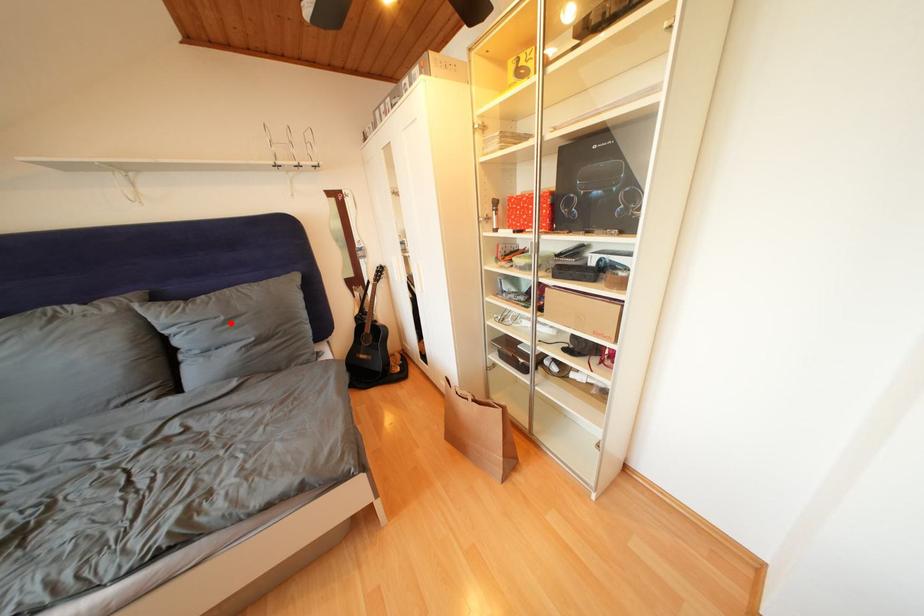
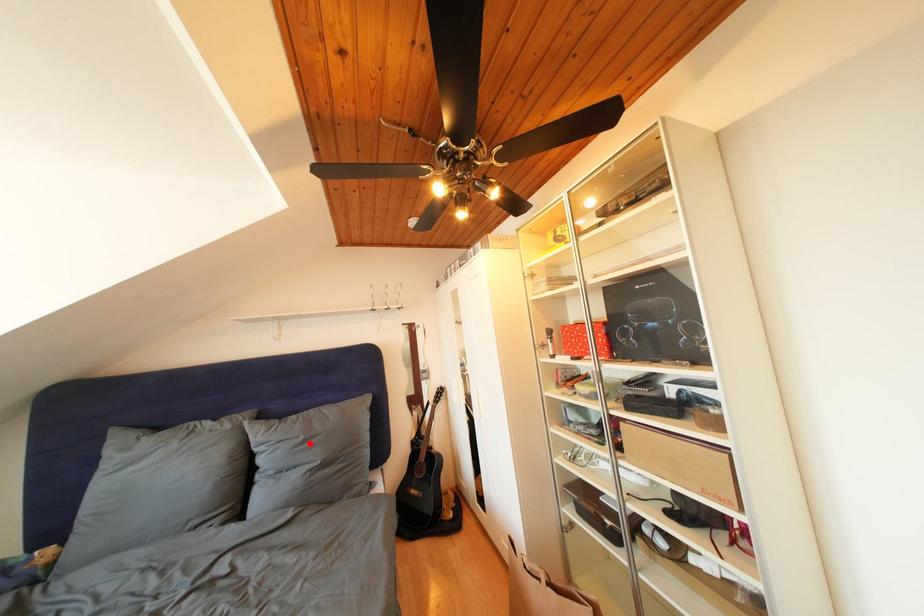
From the picture: I am providing you with two images of the same scene from different viewpoints. A red point is marked on the first image and another point is marked on the second image. Is the marked point in image1 the same physical position as the marked point in image2?

Yes